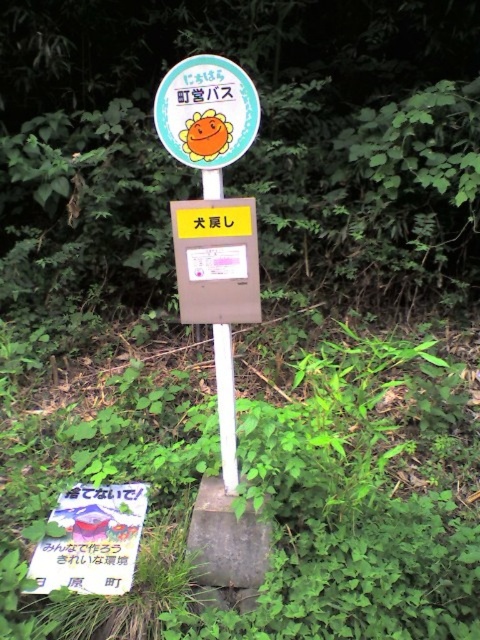
You are standing at the bus stop sign and looking at the two points labeled point (158, 124) and point (240, 125). Which point is closer to your eyes?

Point (158, 124) is further to the camera than point (240, 125), so the point closer to your eyes is point (240, 125).

You are standing at the bus stop sign and want to locate the point marked as point [216,260]. Where exactly is this point located?

The point [216,260] is on the matte brown box at center.

You are a tourist at the bus stop and need to read the instructions. Which object should you look at first, the matte brown box at center or the white plastic sign at center?

You should look at the white plastic sign at center first because the matte brown box at center is located below it, meaning the white plastic sign at center is positioned higher up and likely contains the main instructions.